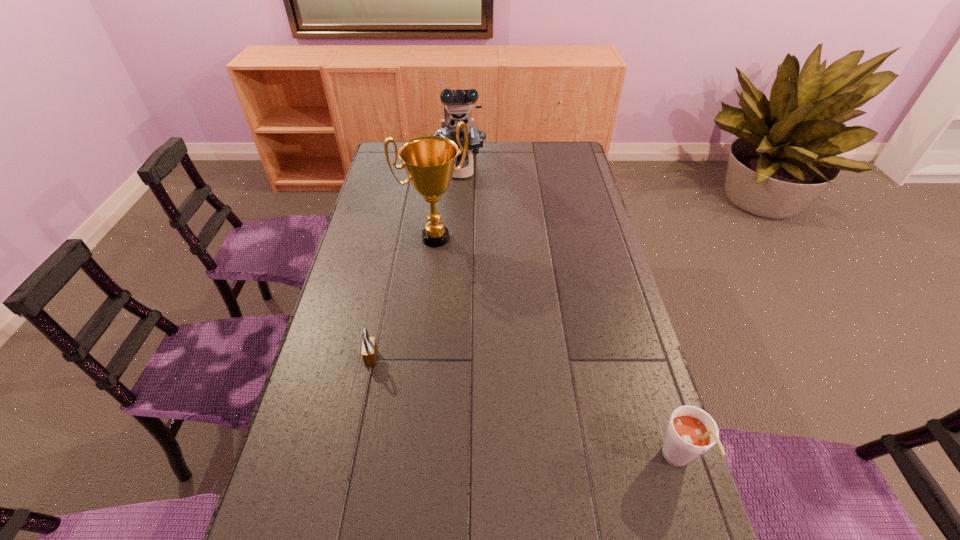
Image resolution: width=960 pixels, height=540 pixels. What are the coordinates of `the leftmost object` in the screenshot? It's located at (369, 353).

What are the coordinates of `the shortest object` in the screenshot? It's located at (369, 353).

At what (x,y) coordinates should I click in order to perform the action: click on the nearest object. Please return your answer as a coordinate pair (x, y). Looking at the image, I should click on (691, 431).

You are a GUI agent. You are given a task and a screenshot of the screen. Output one action in this format:
    pyautogui.click(x=<x>, y=<y>)
    Task: Click on the root beer
    The height and width of the screenshot is (540, 960).
    Given the screenshot: What is the action you would take?
    pyautogui.click(x=691, y=431)

What are the coordinates of `the second farthest object` in the screenshot? It's located at (429, 161).

You are a GUI agent. You are given a task and a screenshot of the screen. Output one action in this format:
    pyautogui.click(x=<x>, y=<y>)
    Task: Click on the microscope
    
    Given the screenshot: What is the action you would take?
    pyautogui.click(x=457, y=103)

Image resolution: width=960 pixels, height=540 pixels. What are the coordinates of `free space located on the right of the third farthest object` in the screenshot? It's located at (396, 358).

Where is `vacant point located 0.150m on the front view with handles of the award`? This screenshot has height=540, width=960. vacant point located 0.150m on the front view with handles of the award is located at coordinates (468, 282).

Find the location of a particular element. The width and height of the screenshot is (960, 540). vacant space located 0.050m on the front view with handles of the award is located at coordinates (455, 262).

Where is `free space located on the front view with handles of the award`? This screenshot has height=540, width=960. free space located on the front view with handles of the award is located at coordinates (490, 316).